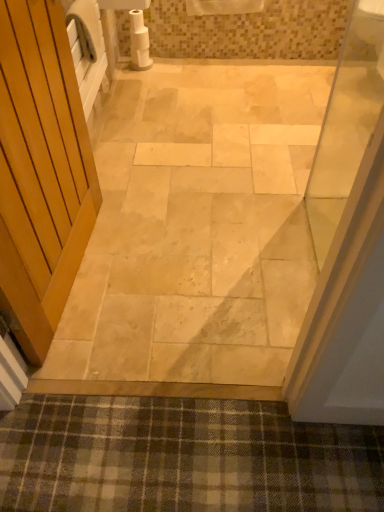
Where is `plaid fabric bath mat at lower center`? plaid fabric bath mat at lower center is located at coordinates pyautogui.click(x=182, y=457).

I want to click on natural stone floor at center, so click(197, 227).

Does white matte toilet paper at upper center have a greater height compared to natural stone floor at center?

Yes.

Does white matte toilet paper at upper center have a greater width compared to natural stone floor at center?

No.

From a real-world perspective, is white matte toilet paper at upper center positioned above or below natural stone floor at center?

In terms of real-world spatial position, white matte toilet paper at upper center is above natural stone floor at center.

Locate an element on the screen. Image resolution: width=384 pixels, height=512 pixels. path in front of the white matte toilet paper at upper center is located at coordinates (197, 227).

Is point (160, 111) positioned behind point (122, 485)?

Yes.

Is natural stone floor at center aimed at plaid fabric bath mat at lower center?

Yes, natural stone floor at center is turned towards plaid fabric bath mat at lower center.

Is natural stone floor at center shorter than plaid fabric bath mat at lower center?

In fact, natural stone floor at center may be taller than plaid fabric bath mat at lower center.

Are natural stone floor at center and plaid fabric bath mat at lower center beside each other?

No.

From a real-world perspective, relative to natural stone floor at center, is plaid fabric bath mat at lower center vertically above or below?

Clearly, from a real-world perspective, plaid fabric bath mat at lower center is above natural stone floor at center.

Does plaid fabric bath mat at lower center have a greater width compared to natural stone floor at center?

No.

Is plaid fabric bath mat at lower center outside of natural stone floor at center?

Indeed, plaid fabric bath mat at lower center is completely outside natural stone floor at center.

Consider the image. Considering the sizes of objects white matte toilet paper at upper center and plaid fabric bath mat at lower center in the image provided, who is bigger, white matte toilet paper at upper center or plaid fabric bath mat at lower center?

With larger size is plaid fabric bath mat at lower center.

Is white matte toilet paper at upper center aimed at plaid fabric bath mat at lower center?

No, white matte toilet paper at upper center is not turned towards plaid fabric bath mat at lower center.

From a real-world perspective, relative to plaid fabric bath mat at lower center, is white matte toilet paper at upper center vertically above or below?

Clearly, from a real-world perspective, white matte toilet paper at upper center is above plaid fabric bath mat at lower center.

Locate an element on the screen. This screenshot has height=512, width=384. toilet paper that appears behind the plaid fabric bath mat at lower center is located at coordinates (139, 41).

Can you confirm if natural stone floor at center is shorter than white matte toilet paper at upper center?

Yes.

Between natural stone floor at center and white matte toilet paper at upper center, which one has larger size?

natural stone floor at center is bigger.

From the image's perspective, is natural stone floor at center positioned above or below white matte toilet paper at upper center?

natural stone floor at center is below white matte toilet paper at upper center.

Considering the relative sizes of plaid fabric bath mat at lower center and white matte toilet paper at upper center in the image provided, is plaid fabric bath mat at lower center taller than white matte toilet paper at upper center?

Incorrect, the height of plaid fabric bath mat at lower center is not larger of that of white matte toilet paper at upper center.

Can white matte toilet paper at upper center be found inside plaid fabric bath mat at lower center?

That's incorrect, white matte toilet paper at upper center is not inside plaid fabric bath mat at lower center.

Is point (328, 480) behind point (148, 61)?

No, it is in front of (148, 61).

In the scene shown: How much distance is there between plaid fabric bath mat at lower center and white matte toilet paper at upper center?

The distance of plaid fabric bath mat at lower center from white matte toilet paper at upper center is 2.40 meters.

Locate an element on the screen. This screenshot has width=384, height=512. path below the white matte toilet paper at upper center (from a real-world perspective) is located at coordinates (197, 227).

At what (x,y) coordinates should I click in order to perform the action: click on bath mat lying below the natural stone floor at center (from the image's perspective). Please return your answer as a coordinate pair (x, y). The height and width of the screenshot is (512, 384). Looking at the image, I should click on (182, 457).

Looking at the image, which one is located closer to plaid fabric bath mat at lower center, natural stone floor at center or white matte toilet paper at upper center?

natural stone floor at center is closer to plaid fabric bath mat at lower center.

Estimate the real-world distances between objects in this image. Which object is further from white matte toilet paper at upper center, natural stone floor at center or plaid fabric bath mat at lower center?

plaid fabric bath mat at lower center.

Looking at the image, which one is located further to plaid fabric bath mat at lower center, white matte toilet paper at upper center or natural stone floor at center?

Based on the image, white matte toilet paper at upper center appears to be further to plaid fabric bath mat at lower center.

Estimate the real-world distances between objects in this image. Which object is further from natural stone floor at center, plaid fabric bath mat at lower center or white matte toilet paper at upper center?

The object further to natural stone floor at center is white matte toilet paper at upper center.

Which object lies nearer to the anchor point natural stone floor at center, white matte toilet paper at upper center or plaid fabric bath mat at lower center?

plaid fabric bath mat at lower center.

From the image, which object appears to be nearer to white matte toilet paper at upper center, plaid fabric bath mat at lower center or natural stone floor at center?

natural stone floor at center is positioned closer to the anchor white matte toilet paper at upper center.

Find the location of a particular element. The image size is (384, 512). path between white matte toilet paper at upper center and plaid fabric bath mat at lower center vertically is located at coordinates (197, 227).